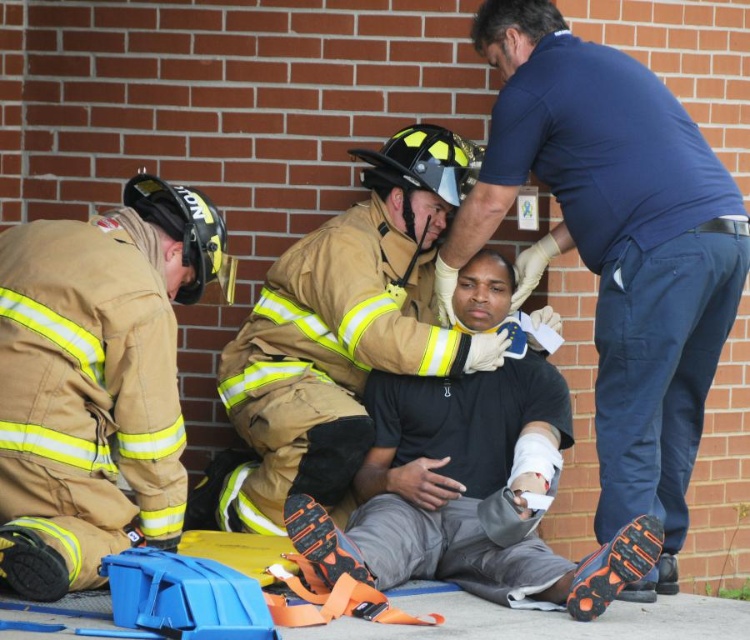
Is point (490, 193) farther from viewer compared to point (518, 602)?

Yes, it is behind point (518, 602).

Is the position of blue cotton shirt at upper center more distant than that of black matte shirt at center?

That is True.

Locate an element on the screen. blue cotton shirt at upper center is located at coordinates (615, 248).

Locate an element on the screen. This screenshot has width=750, height=640. blue cotton shirt at upper center is located at coordinates (615, 248).

Who is lower down, brown leather jacket at center or black matte shirt at center?

black matte shirt at center is lower down.

Who is shorter, brown leather jacket at center or black matte shirt at center?

With less height is black matte shirt at center.

Measure the distance between point (x=266, y=492) and camera.

Point (x=266, y=492) and camera are 5.63 meters apart.

Image resolution: width=750 pixels, height=640 pixels. In order to click on brown leather jacket at center in this screenshot , I will do `click(345, 330)`.

What do you see at coordinates (615, 248) in the screenshot? This screenshot has height=640, width=750. I see `blue cotton shirt at upper center` at bounding box center [615, 248].

Who is lower down, blue cotton shirt at upper center or brown leather jacket at center?

brown leather jacket at center is below.

You are a GUI agent. You are given a task and a screenshot of the screen. Output one action in this format:
    pyautogui.click(x=<x>, y=<y>)
    Task: Click on the blue cotton shirt at upper center
    The height and width of the screenshot is (640, 750).
    Given the screenshot: What is the action you would take?
    pyautogui.click(x=615, y=248)

Where is `blue cotton shirt at upper center`? Image resolution: width=750 pixels, height=640 pixels. blue cotton shirt at upper center is located at coordinates (615, 248).